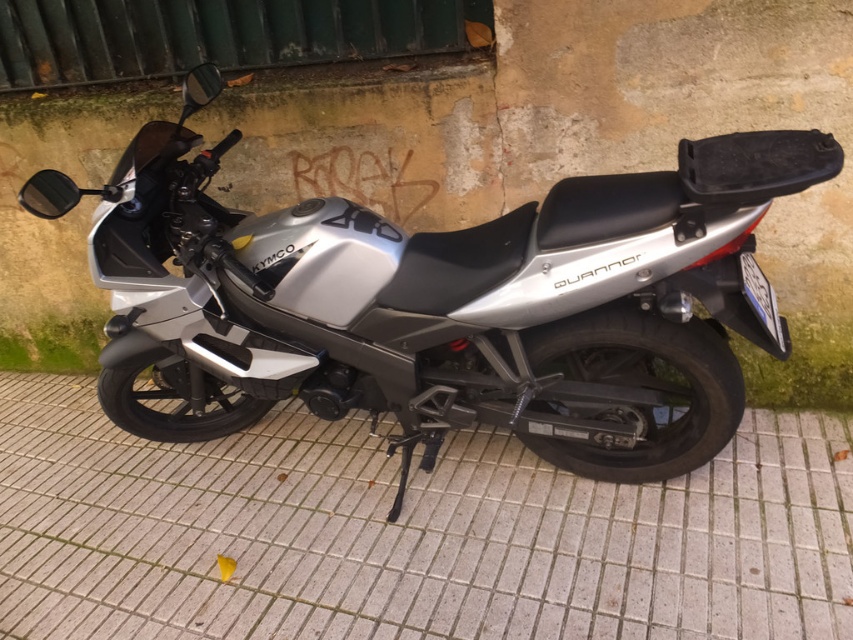
How much distance is there between silver metallic motorcycle at center and white tile pavement at center?

silver metallic motorcycle at center and white tile pavement at center are 21.65 inches apart from each other.

Which of these two, silver metallic motorcycle at center or white tile pavement at center, stands shorter?

With less height is white tile pavement at center.

Which is behind, point (550, 230) or point (503, 436)?

Positioned behind is point (503, 436).

Identify the location of silver metallic motorcycle at center. This screenshot has width=853, height=640. (444, 301).